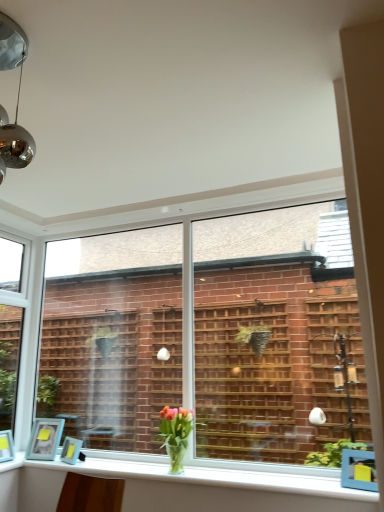
Question: Is matte blue picture frame at lower left, which is the 1th picture frame in left-to-right order, wider or thinner than matte blue picture frame at lower left, the 2th picture frame when ordered from left to right?

Choices:
 (A) thin
 (B) wide

Answer: (A)

Question: Choose the correct answer: Is matte blue picture frame at lower left, positioned as the second picture frame in right-to-left order, inside matte blue picture frame at lower left, the 2th picture frame when ordered from left to right, or outside it?

Choices:
 (A) outside
 (B) inside

Answer: (A)

Question: Estimate the real-world distances between objects in this image. Which object is closer to the clear glass window at center, which appears as the 1th window when viewed from the right?

Choices:
 (A) matte blue picture frame at lower left, which is the 1th picture frame in left-to-right order
 (B) white glossy window sill at lower center
 (C) matte blue picture frame at lower left, positioned as the 1th picture frame in right-to-left order
 (D) clear glass window at left, which appears as the 2th window when viewed from the right
 (E) translucent glass vase at lower center

Answer: (D)

Question: Which is farther from the white glossy window sill at lower center?

Choices:
 (A) clear glass window at left, which appears as the 2th window when viewed from the right
 (B) clear glass window at center, which appears as the 1th window when viewed from the right
 (C) matte blue picture frame at lower left, which is the 1th picture frame in left-to-right order
 (D) matte blue picture frame at lower left, the 2th picture frame when ordered from left to right
 (E) translucent glass vase at lower center

Answer: (B)